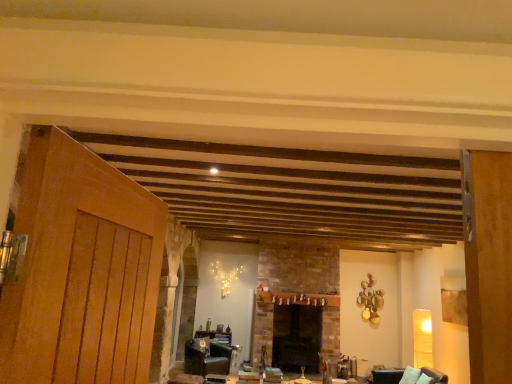
In order to face matte black armchair at lower left, should I rotate leftwards or rightwards?

Rotate your view left by about 6.890°.

Where is `dark brown leather armchair at lower right`? The height and width of the screenshot is (384, 512). dark brown leather armchair at lower right is located at coordinates (409, 376).

Between dark brown leather armchair at lower right and wooden table at center, which one has smaller size?

Smaller between the two is wooden table at center.

Is dark brown leather armchair at lower right positioned with its back to wooden table at center?

No, dark brown leather armchair at lower right is not facing away from wooden table at center.

Considering the relative sizes of dark brown leather armchair at lower right and wooden table at center in the image provided, is dark brown leather armchair at lower right wider than wooden table at center?

Indeed, dark brown leather armchair at lower right has a greater width compared to wooden table at center.

Which object is positioned more to the left, dark brown leather armchair at lower right or wooden table at center?

wooden table at center is more to the left.

Which is more to the right, matte black armchair at lower left or dark brown leather armchair at lower right?

dark brown leather armchair at lower right is more to the right.

Between matte black armchair at lower left and dark brown leather armchair at lower right, which one has larger size?

With larger size is matte black armchair at lower left.

From a real-world perspective, which is physically below, matte black armchair at lower left or dark brown leather armchair at lower right?

matte black armchair at lower left, from a real-world perspective.

From the image's perspective, between matte black armchair at lower left and dark brown leather armchair at lower right, which one is located above?

dark brown leather armchair at lower right is shown above in the image.

Where is `table below the dark brick fireplace at center (from the image's perspective)`? table below the dark brick fireplace at center (from the image's perspective) is located at coordinates tap(215, 336).

Does wooden table at center turn towards dark brick fireplace at center?

No, wooden table at center does not turn towards dark brick fireplace at center.

Looking at this image, which object is thinner, wooden table at center or dark brick fireplace at center?

Thinner between the two is wooden table at center.

From a real-world perspective, is dark brick fireplace at center on wooden table at center?

Correct, in the physical world, dark brick fireplace at center is higher than wooden table at center.

What's the angular difference between dark brick fireplace at center and wooden table at center's facing directions?

The facing directions of dark brick fireplace at center and wooden table at center are 1.79 degrees apart.

How far apart are dark brick fireplace at center and wooden table at center?

dark brick fireplace at center and wooden table at center are 3.61 feet apart.

Considering the sizes of objects dark brick fireplace at center and wooden table at center in the image provided, who is bigger, dark brick fireplace at center or wooden table at center?

Bigger between the two is dark brick fireplace at center.

Considering the sizes of matte black armchair at lower left and wooden table at center in the image, is matte black armchair at lower left wider or thinner than wooden table at center?

In the image, matte black armchair at lower left appears to be wider than wooden table at center.

In the scene shown: How different are the orientations of matte black armchair at lower left and wooden table at center in degrees?

They differ by 47.7 degrees in their facing directions.

From the picture: Considering the positions of objects matte black armchair at lower left and wooden table at center in the image provided, who is in front, matte black armchair at lower left or wooden table at center?

matte black armchair at lower left is closer to the camera.

What are the coordinates of `table behind the matte black armchair at lower left` in the screenshot? It's located at (215, 336).

Does dark brick fireplace at center turn towards dark brown leather armchair at lower right?

No.

From a real-world perspective, does dark brick fireplace at center sit lower than dark brown leather armchair at lower right?

Incorrect, from a real-world perspective, dark brick fireplace at center is higher than dark brown leather armchair at lower right.

Considering the relative sizes of dark brick fireplace at center and dark brown leather armchair at lower right in the image provided, is dark brick fireplace at center wider than dark brown leather armchair at lower right?

In fact, dark brick fireplace at center might be narrower than dark brown leather armchair at lower right.

Find the location of a particular element. The height and width of the screenshot is (384, 512). fireplace positioned vertically above the dark brown leather armchair at lower right (from a real-world perspective) is located at coordinates (297, 338).

Considering the sizes of objects dark brown leather armchair at lower right and matte black armchair at lower left in the image provided, who is thinner, dark brown leather armchair at lower right or matte black armchair at lower left?

matte black armchair at lower left.

Is point (438, 379) less distant than point (211, 366)?

That is True.

Considering the sizes of objects dark brown leather armchair at lower right and matte black armchair at lower left in the image provided, who is taller, dark brown leather armchair at lower right or matte black armchair at lower left?

Standing taller between the two is matte black armchair at lower left.

Considering the positions of objects dark brown leather armchair at lower right and matte black armchair at lower left in the image provided, who is more to the right, dark brown leather armchair at lower right or matte black armchair at lower left?

dark brown leather armchair at lower right.

The width and height of the screenshot is (512, 384). There is a dark brown leather armchair at lower right. Identify the location of table above it (from a real-world perspective). (215, 336).

Find the location of a particular element. Image resolution: width=512 pixels, height=384 pixels. furniture lying below the dark brown leather armchair at lower right (from the image's perspective) is located at coordinates (207, 359).

When comparing their distances from dark brown leather armchair at lower right, does matte black armchair at lower left or wooden table at center seem closer?

Among the two, matte black armchair at lower left is located nearer to dark brown leather armchair at lower right.

Estimate the real-world distances between objects in this image. Which object is further from matte black armchair at lower left, dark brick fireplace at center or dark brown leather armchair at lower right?

The object further to matte black armchair at lower left is dark brown leather armchair at lower right.

From the image, which object appears to be nearer to wooden table at center, dark brown leather armchair at lower right or matte black armchair at lower left?

matte black armchair at lower left lies closer to wooden table at center than the other object.

Estimate the real-world distances between objects in this image. Which object is further from dark brown leather armchair at lower right, wooden table at center or dark brick fireplace at center?

wooden table at center is further to dark brown leather armchair at lower right.

From the image, which object appears to be farther from wooden table at center, dark brown leather armchair at lower right or dark brick fireplace at center?

dark brown leather armchair at lower right.

Based on the photo, which object lies nearer to the anchor point dark brown leather armchair at lower right, dark brick fireplace at center or matte black armchair at lower left?

The object closer to dark brown leather armchair at lower right is dark brick fireplace at center.

Looking at the image, which one is located closer to dark brick fireplace at center, matte black armchair at lower left or wooden table at center?

The object closer to dark brick fireplace at center is wooden table at center.

When comparing their distances from matte black armchair at lower left, does wooden table at center or dark brown leather armchair at lower right seem closer?

Among the two, wooden table at center is located nearer to matte black armchair at lower left.

In order to click on table between matte black armchair at lower left and dark brown leather armchair at lower right in the horizontal direction in this screenshot , I will do `click(215, 336)`.

At what (x,y) coordinates should I click in order to perform the action: click on fireplace between dark brown leather armchair at lower right and wooden table at center in the front-back direction. Please return your answer as a coordinate pair (x, y). Looking at the image, I should click on (297, 338).

Image resolution: width=512 pixels, height=384 pixels. In order to click on fireplace between matte black armchair at lower left and dark brown leather armchair at lower right in this screenshot , I will do `click(297, 338)`.

Locate an element on the screen. The width and height of the screenshot is (512, 384). table situated between matte black armchair at lower left and dark brick fireplace at center from left to right is located at coordinates (215, 336).